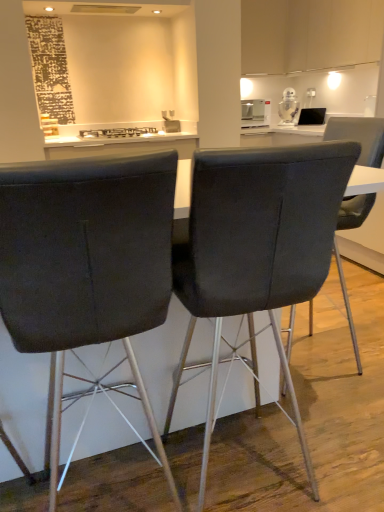
Find the location of a particular element. This screenshot has width=384, height=512. free space in front of velvet dark gray chair at center, which ranks as the first chair in right-to-left order is located at coordinates pos(341,412).